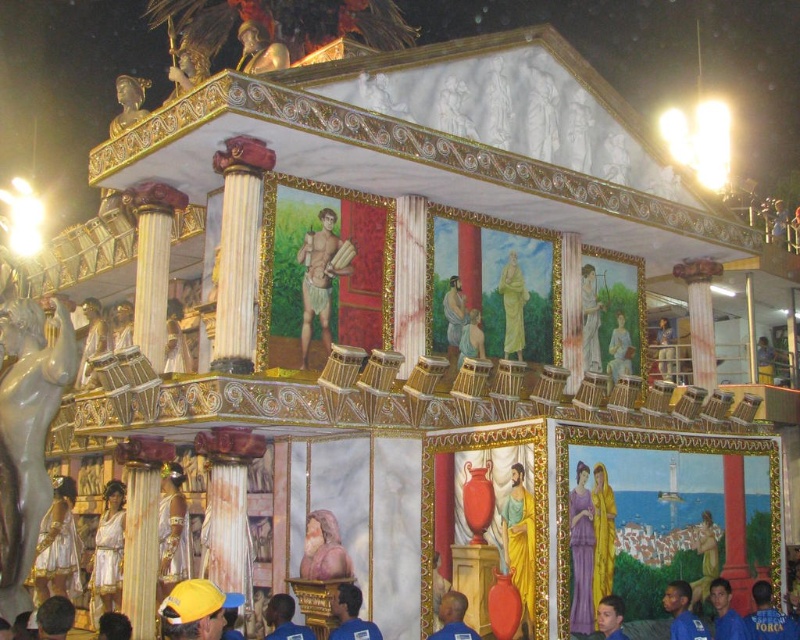
You are an observer standing in front of the float. You notice the golden fabric figure at center and the yellow fabric person at lower right. Which one appears taller from your viewpoint?

The yellow fabric person at lower right is taller than the golden fabric figure at center.

You are an art student analyzing the float. You notice two statues on the float. The gold metallic statue at upper center and the smooth white statue at upper right. Which statue is positioned higher up on the float?

The gold metallic statue at upper center is positioned higher up on the float as it is located above the smooth white statue at upper right.